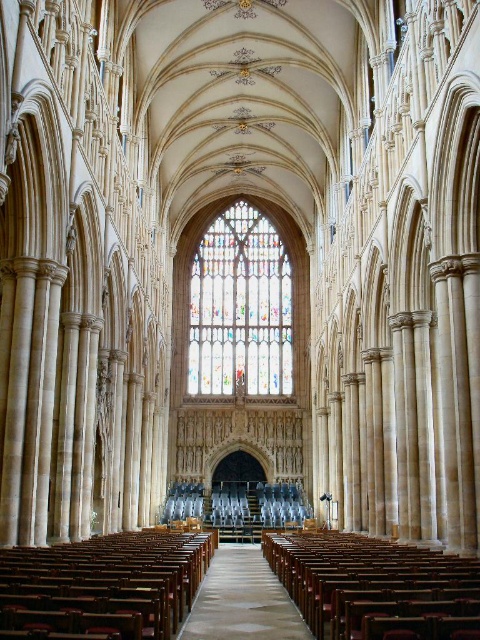
Question: Can you confirm if multicolored stained glass at center is bigger than wooden polished aisle at center?

Choices:
 (A) yes
 (B) no

Answer: (A)

Question: Which object is closer to the camera taking this photo?

Choices:
 (A) multicolored stained glass at center
 (B) wooden polished aisle at center

Answer: (B)

Question: Can you confirm if multicolored stained glass at center is positioned below wooden polished aisle at center?

Choices:
 (A) yes
 (B) no

Answer: (B)

Question: Is multicolored stained glass at center further to camera compared to wooden polished aisle at center?

Choices:
 (A) yes
 (B) no

Answer: (A)

Question: Which of the following is the farthest from the observer?

Choices:
 (A) wooden polished aisle at center
 (B) multicolored stained glass at center

Answer: (B)